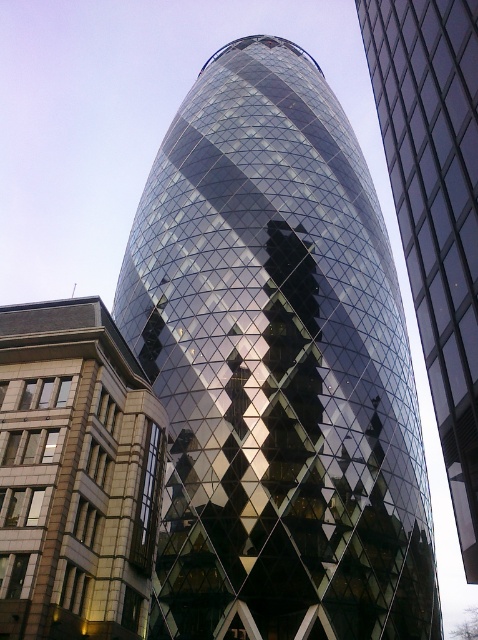
Question: Which point is farther to the camera?

Choices:
 (A) (220, 438)
 (B) (458, 134)

Answer: (A)

Question: Among these objects, which one is farthest from the camera?

Choices:
 (A) beige stone building at left
 (B) glossy glass tower at center

Answer: (B)

Question: Does glossy glass tower at center appear on the left side of beige stone building at left?

Choices:
 (A) no
 (B) yes

Answer: (A)

Question: Which point is closer to the camera?

Choices:
 (A) glossy glass tower at center
 (B) reflective glass tower at center

Answer: (B)

Question: Can you confirm if glossy glass tower at center is positioned below reflective glass tower at center?

Choices:
 (A) no
 (B) yes

Answer: (A)

Question: Is glossy glass tower at center below beige stone building at left?

Choices:
 (A) yes
 (B) no

Answer: (B)